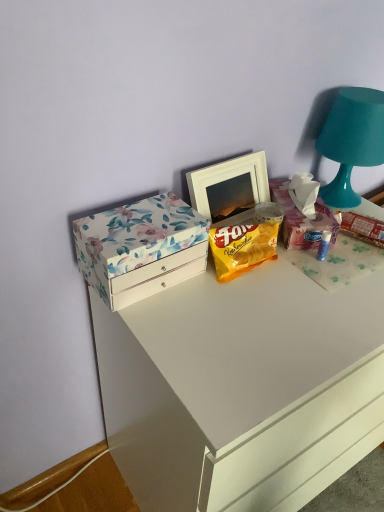
Question: Should I look upward or downward to see teal matte table lamp at upper right?

Choices:
 (A) down
 (B) up

Answer: (B)

Question: Does teal matte table lamp at upper right have a greater width compared to floral paper box at left?

Choices:
 (A) no
 (B) yes

Answer: (B)

Question: Is teal matte table lamp at upper right located outside floral paper box at left?

Choices:
 (A) no
 (B) yes

Answer: (B)

Question: Does teal matte table lamp at upper right have a lesser height compared to floral paper box at left?

Choices:
 (A) no
 (B) yes

Answer: (A)

Question: Is the position of teal matte table lamp at upper right less distant than that of floral paper box at left?

Choices:
 (A) yes
 (B) no

Answer: (B)

Question: From the image's perspective, is teal matte table lamp at upper right under floral paper box at left?

Choices:
 (A) no
 (B) yes

Answer: (A)

Question: From a real-world perspective, is teal matte table lamp at upper right under floral paper box at left?

Choices:
 (A) yes
 (B) no

Answer: (B)

Question: Does floral cardboard box at upper right come in front of teal matte table lamp at upper right?

Choices:
 (A) no
 (B) yes

Answer: (B)

Question: Could you tell me if floral cardboard box at upper right is turned towards teal matte table lamp at upper right?

Choices:
 (A) no
 (B) yes

Answer: (A)

Question: Considering the relative positions of floral cardboard box at upper right and teal matte table lamp at upper right in the image provided, is floral cardboard box at upper right to the left of teal matte table lamp at upper right from the viewer's perspective?

Choices:
 (A) yes
 (B) no

Answer: (A)

Question: Is floral cardboard box at upper right thinner than teal matte table lamp at upper right?

Choices:
 (A) no
 (B) yes

Answer: (A)

Question: Does floral cardboard box at upper right have a greater width compared to teal matte table lamp at upper right?

Choices:
 (A) yes
 (B) no

Answer: (A)

Question: Can we say floral cardboard box at upper right lies outside teal matte table lamp at upper right?

Choices:
 (A) no
 (B) yes

Answer: (B)

Question: Considering the relative sizes of teal matte table lamp at upper right and floral cardboard box at upper right in the image provided, is teal matte table lamp at upper right bigger than floral cardboard box at upper right?

Choices:
 (A) yes
 (B) no

Answer: (A)